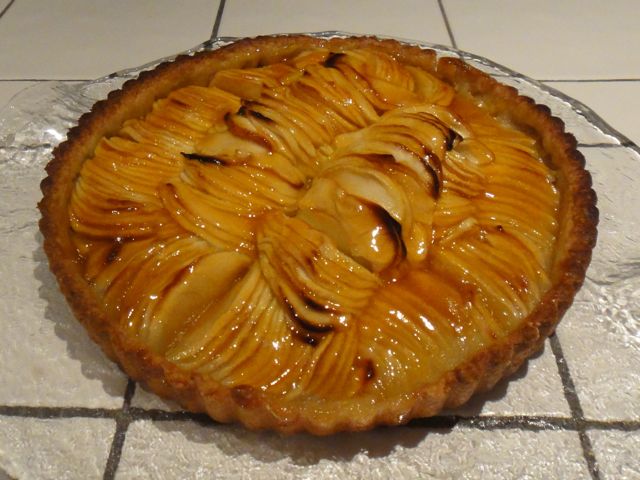
At what (x,y) coordinates should I click in order to perform the action: click on tile. Please return your answer as a coordinate pair (x, y). The image size is (640, 480). Looking at the image, I should click on (493, 448), (601, 345).